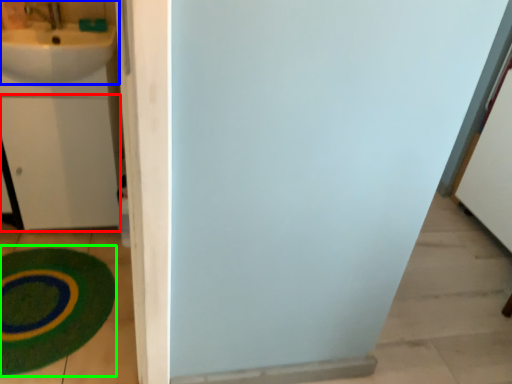
Question: Which is farther away from drawer (highlighted by a red box)? sink (highlighted by a blue box) or bath mat (highlighted by a green box)?

Choices:
 (A) sink
 (B) bath mat

Answer: (B)